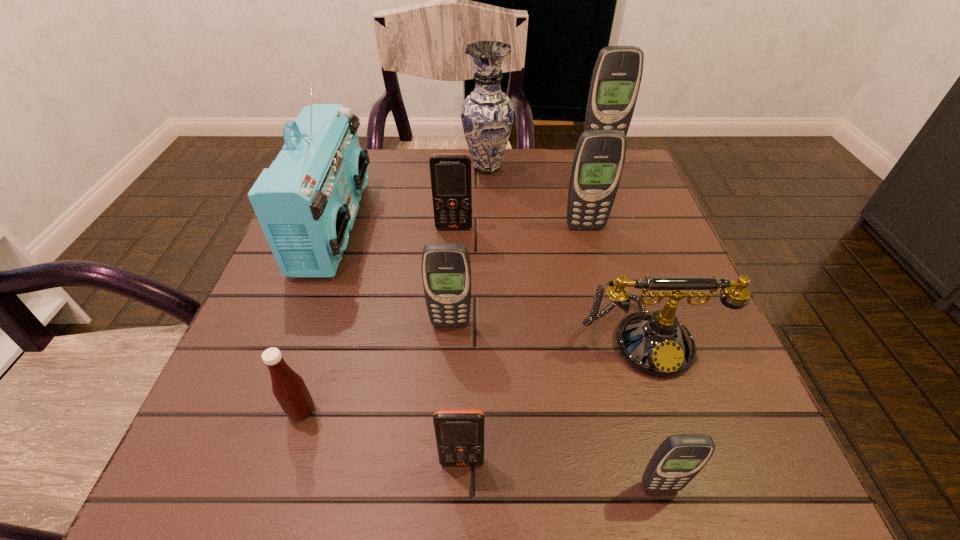
Locate an element on the screen. The image size is (960, 540). the fourth closest gray cellular telephone relative to the radio receiver is located at coordinates (679, 458).

I want to click on vacant area that satisfies the following two spatial constraints: 1. on the front-facing side of the blue radio receiver; 2. on the back side of the Tabasco sauce, so (x=266, y=410).